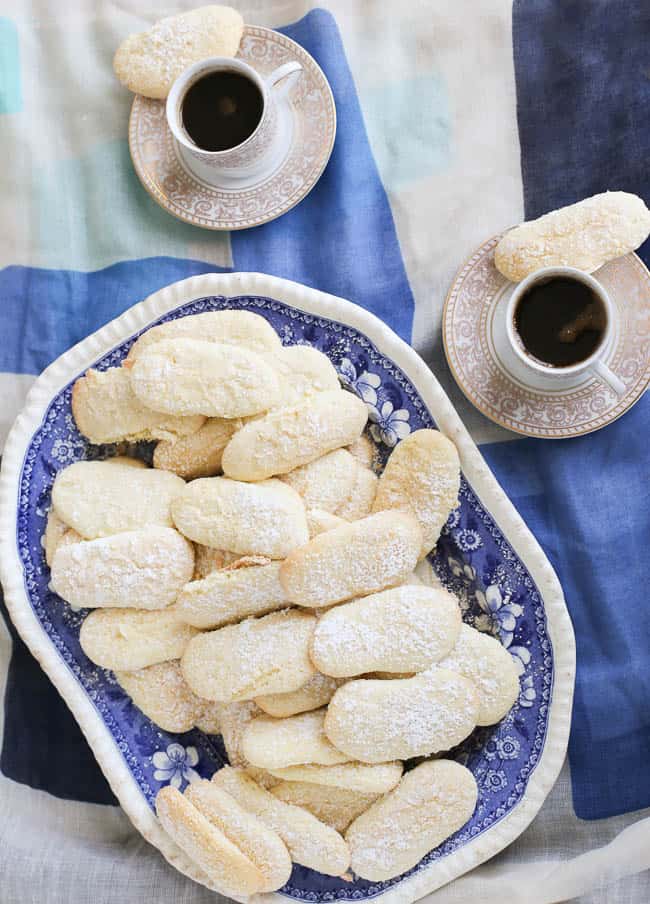
Identify the location of tablecloth. This screenshot has height=904, width=650. (617, 590).